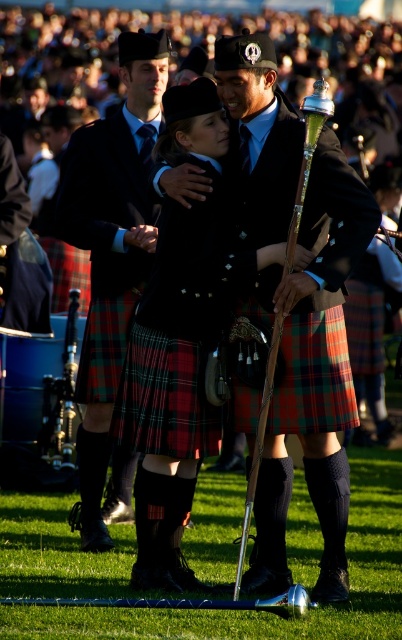
What are the coordinates of the matte black kilt at center?

The coordinates of the matte black kilt at center are 0.411 in the x direction and 0.279 in the y direction.